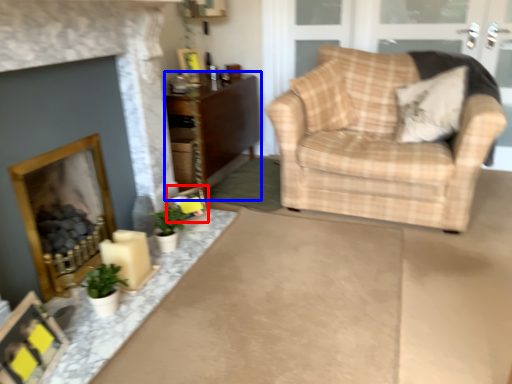
Question: Which object appears closest to the camera in this image, picture frame (highlighted by a red box) or cabinetry (highlighted by a blue box)?

Choices:
 (A) picture frame
 (B) cabinetry

Answer: (A)